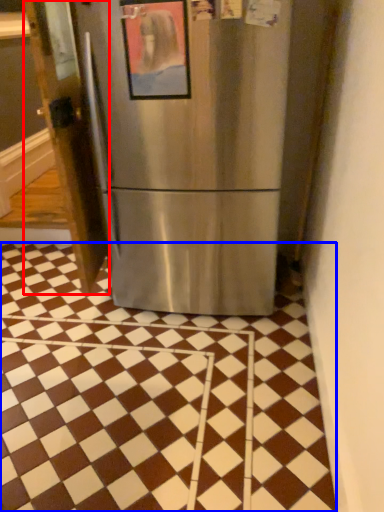
Question: Which object is closer to the camera taking this photo, door (highlighted by a red box) or tile (highlighted by a blue box)?

Choices:
 (A) door
 (B) tile

Answer: (B)